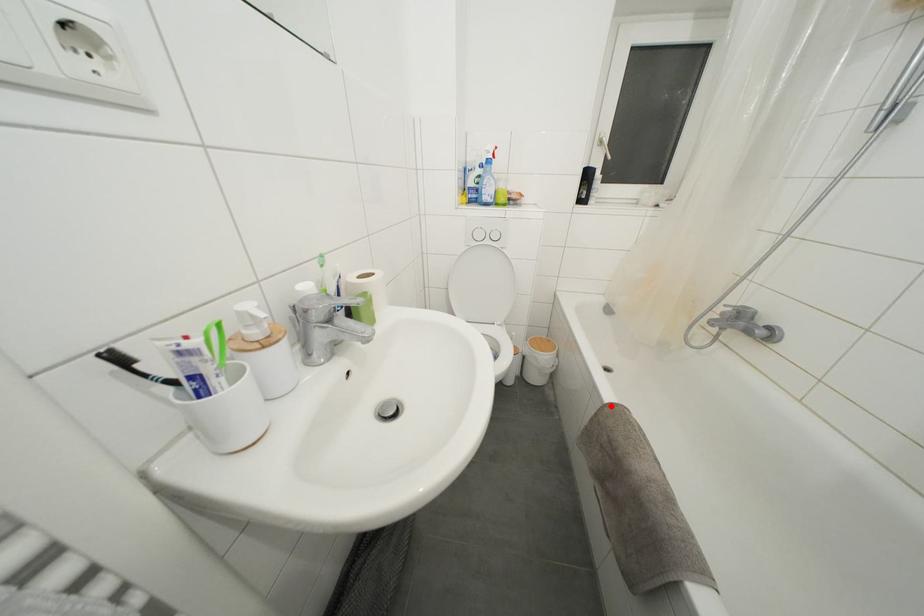
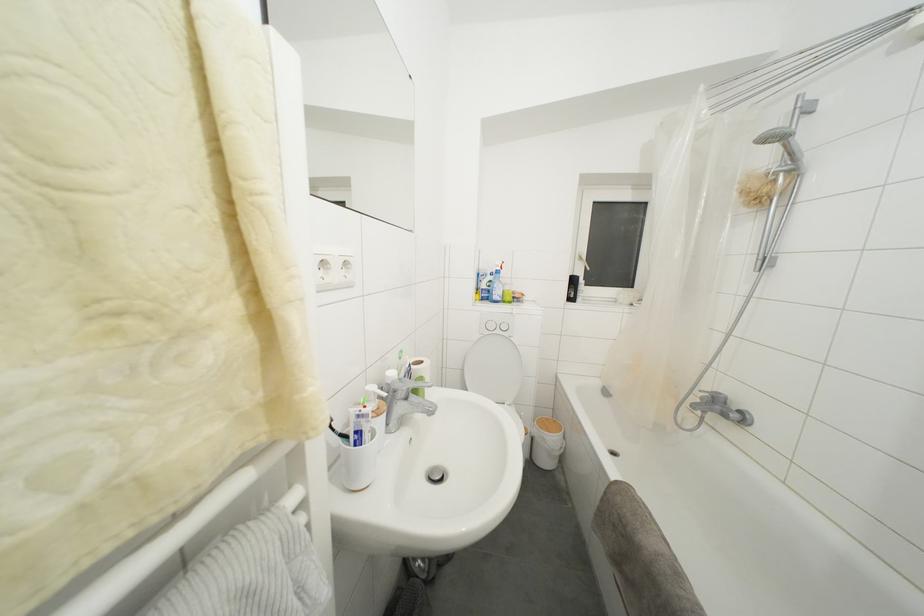
Locate, in the second image, the point that corresponds to the highlighted location in the first image.

(617, 484)